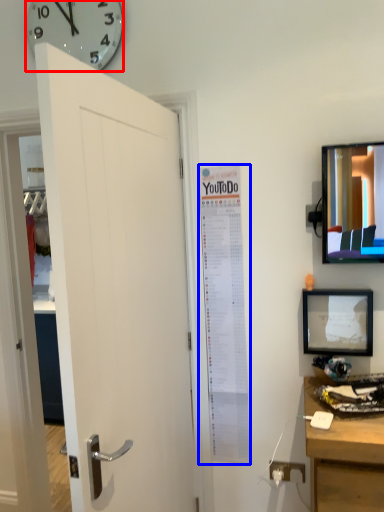
Question: Which point is further to the camera, wall clock (highlighted by a red box) or poster page (highlighted by a blue box)?

Choices:
 (A) wall clock
 (B) poster page

Answer: (B)